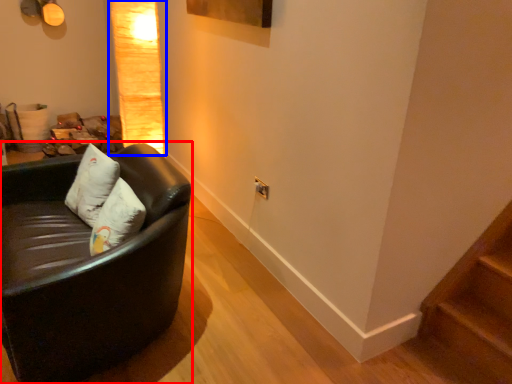
Question: Among these objects, which one is farthest to the camera, studio couch (highlighted by a red box) or lamp (highlighted by a blue box)?

Choices:
 (A) studio couch
 (B) lamp

Answer: (B)